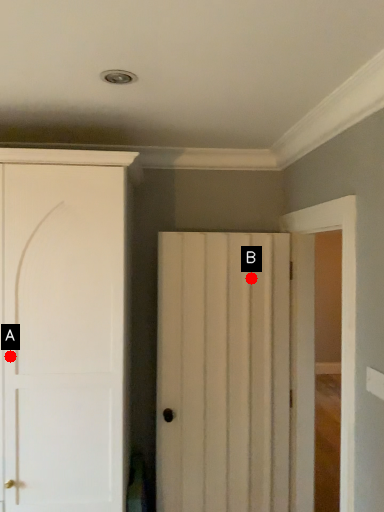
Question: Two points are circled on the image, labeled by A and B beside each circle. Which of the following is the closest to the observer?

Choices:
 (A) A is closer
 (B) B is closer

Answer: (A)